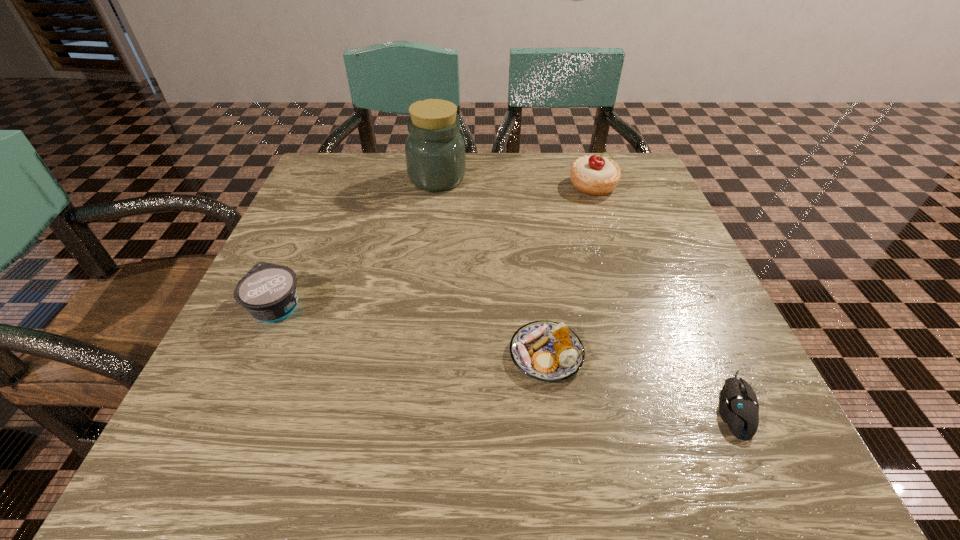
You are a GUI agent. You are given a task and a screenshot of the screen. Output one action in this format:
    pyautogui.click(x=<x>, y=<y>)
    Task: Click on the computer mouse that is at the right edge
    
    Given the screenshot: What is the action you would take?
    pyautogui.click(x=738, y=407)

This screenshot has height=540, width=960. Find the location of `object that is at the far right corner`. object that is at the far right corner is located at coordinates (595, 175).

Image resolution: width=960 pixels, height=540 pixels. I want to click on object that is at the near right corner, so click(738, 407).

What are the coordinates of `vacant space at the far edge of the desktop` in the screenshot? It's located at (399, 168).

Find the location of `vacant space at the near edge of the desktop`. vacant space at the near edge of the desktop is located at coordinates (328, 426).

The width and height of the screenshot is (960, 540). In order to click on free space at the left edge of the desktop in this screenshot , I will do `click(356, 224)`.

Where is `vacant space at the right edge of the desktop`? This screenshot has width=960, height=540. vacant space at the right edge of the desktop is located at coordinates (754, 381).

The width and height of the screenshot is (960, 540). I want to click on vacant area at the far left corner of the desktop, so click(358, 200).

You are a GUI agent. You are given a task and a screenshot of the screen. Output one action in this format:
    pyautogui.click(x=<x>, y=<y>)
    Task: Click on the free space at the near left corner
    This screenshot has height=540, width=960.
    Given the screenshot: What is the action you would take?
    pyautogui.click(x=189, y=456)

The width and height of the screenshot is (960, 540). I want to click on vacant space at the far right corner of the desktop, so click(592, 198).